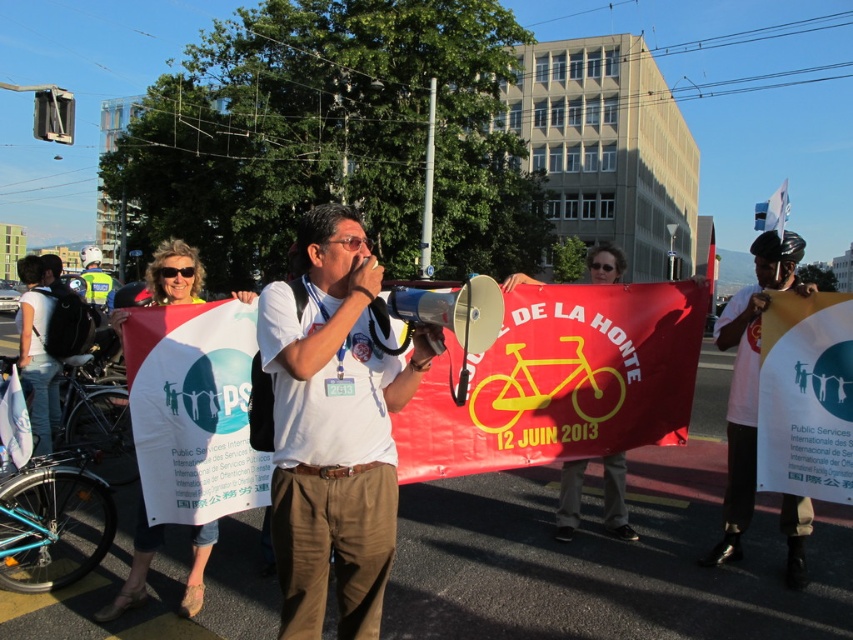
You are a photographer at the protest, and you want to capture a photo where both the white cotton shirt at center and the white paper banner at center are clearly visible. Based on their positions, which one will appear larger in the photo?

The white cotton shirt at center is closer to the viewer than the white paper banner at center, so it will appear larger in the photo.